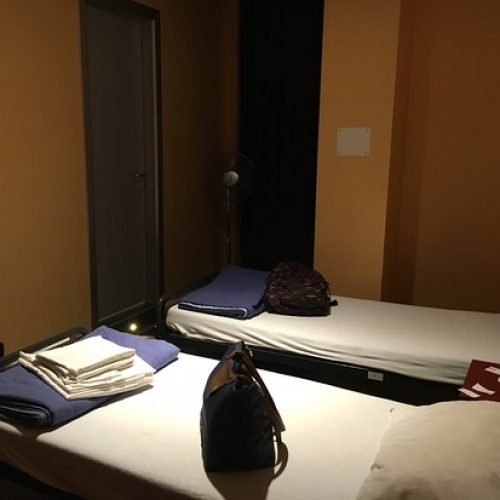
The height and width of the screenshot is (500, 500). In order to click on white sign on wall in this screenshot , I will do `click(88, 194)`, `click(352, 142)`.